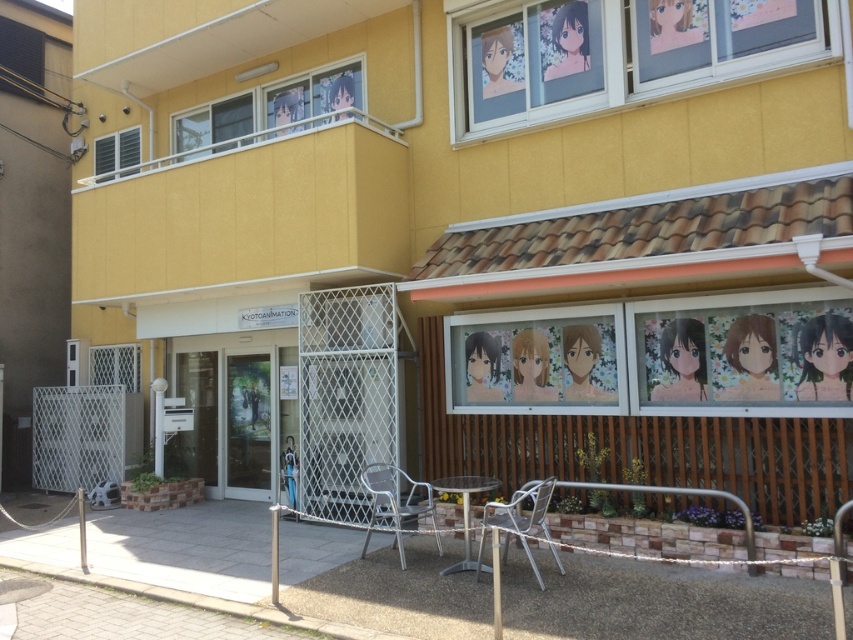
Is silver metallic chair at center to the right of metallic silver chair at lower center from the viewer's perspective?

Incorrect, silver metallic chair at center is not on the right side of metallic silver chair at lower center.

Between silver metallic chair at center and metallic silver chair at lower center, which one has more height?

With more height is silver metallic chair at center.

What do you see at coordinates (395, 502) in the screenshot?
I see `silver metallic chair at center` at bounding box center [395, 502].

Where is `silver metallic chair at center`? silver metallic chair at center is located at coordinates (395, 502).